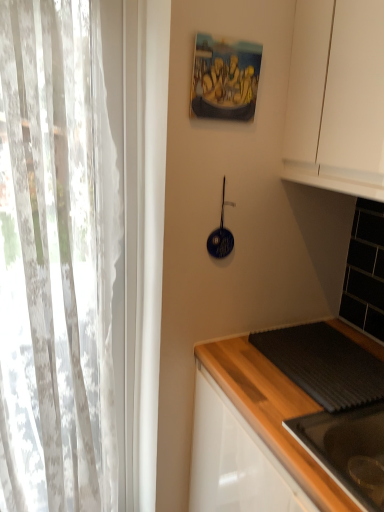
Question: From the image's perspective, is oil painting at upper center on black glossy sink at lower right?

Choices:
 (A) yes
 (B) no

Answer: (A)

Question: Is oil painting at upper center bigger than black glossy sink at lower right?

Choices:
 (A) no
 (B) yes

Answer: (A)

Question: Considering the relative positions of oil painting at upper center and black glossy sink at lower right in the image provided, is oil painting at upper center behind black glossy sink at lower right?

Choices:
 (A) no
 (B) yes

Answer: (B)

Question: From a real-world perspective, is oil painting at upper center beneath black glossy sink at lower right?

Choices:
 (A) yes
 (B) no

Answer: (B)

Question: Does oil painting at upper center have a lesser height compared to black glossy sink at lower right?

Choices:
 (A) yes
 (B) no

Answer: (B)

Question: Is black glossy sink at lower right located within oil painting at upper center?

Choices:
 (A) yes
 (B) no

Answer: (B)

Question: From the image's perspective, is white sheer curtain at left on black glossy sink at lower right?

Choices:
 (A) no
 (B) yes

Answer: (B)

Question: Could you tell me if white sheer curtain at left is turned towards black glossy sink at lower right?

Choices:
 (A) yes
 (B) no

Answer: (B)

Question: From the image's perspective, would you say white sheer curtain at left is shown under black glossy sink at lower right?

Choices:
 (A) no
 (B) yes

Answer: (A)

Question: Considering the relative sizes of white sheer curtain at left and black glossy sink at lower right in the image provided, is white sheer curtain at left smaller than black glossy sink at lower right?

Choices:
 (A) no
 (B) yes

Answer: (A)

Question: From a real-world perspective, is white sheer curtain at left over black glossy sink at lower right?

Choices:
 (A) yes
 (B) no

Answer: (A)

Question: Is white sheer curtain at left at the left side of black glossy sink at lower right?

Choices:
 (A) yes
 (B) no

Answer: (A)

Question: Is white sheer curtain at left bigger than blue glossy frying pan at upper center?

Choices:
 (A) no
 (B) yes

Answer: (B)